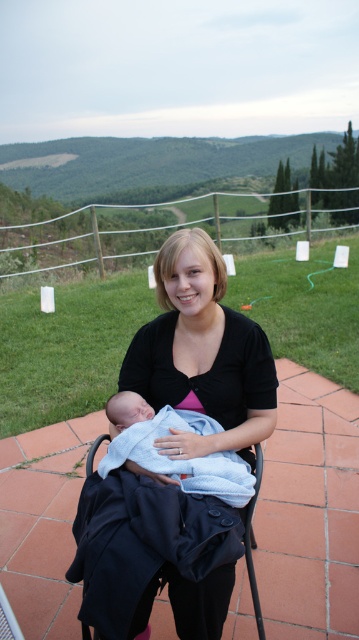
You are a photographer capturing a family portrait. You notice the black fabric at center and the blue cotton blanket at center. Which object is closer to the camera?

The black fabric at center is in front of the blue cotton blanket at center, so it is closer to the camera.

You are a photographer setting up for a family portrait. You notice the black fabric folding chair at center and the blue cotton blanket at center in the scene. Which object is closer to the camera?

The black fabric folding chair at center is closer to the camera than the blue cotton blanket at center because it is positioned in front of it.